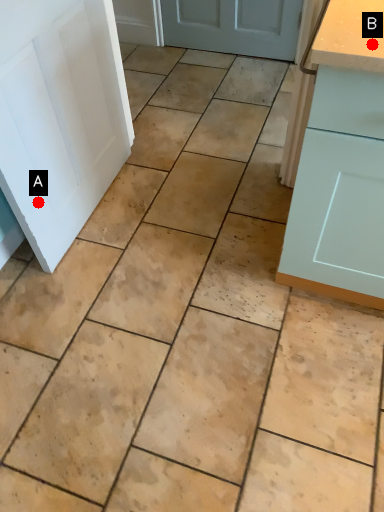
Question: Two points are circled on the image, labeled by A and B beside each circle. Which point is further to the camera?

Choices:
 (A) A is further
 (B) B is further

Answer: (A)